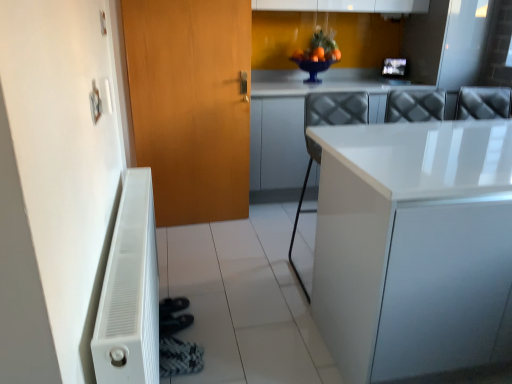
Locate an element on the screen. This screenshot has height=384, width=512. vacant space to the right of wooden door at left is located at coordinates (249, 225).